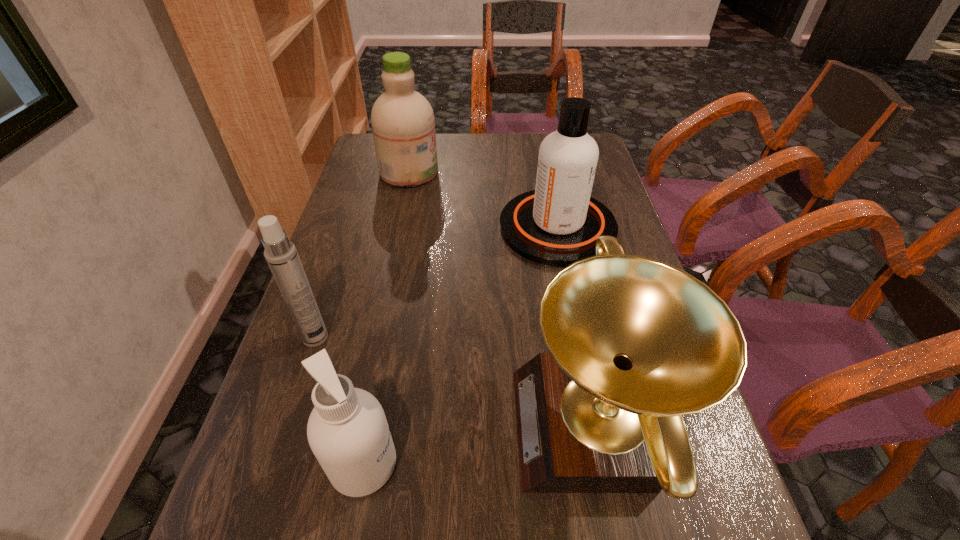
Select which cleansing agent is the closest to the award. Please provide its 2D coordinates. Your answer should be formatted as a tuple, i.e. [(x, y)], where the tuple contains the x and y coordinates of a point satisfying the conditions above.

[(347, 430)]

Where is `the closest cleansing agent relative to the second farthest object`? The image size is (960, 540). the closest cleansing agent relative to the second farthest object is located at coordinates (403, 125).

You are a GUI agent. You are given a task and a screenshot of the screen. Output one action in this format:
    pyautogui.click(x=<x>, y=<y>)
    Task: Click on the free space that satisfies the following two spatial constraints: 1. on the back side of the second nearest cleansing agent; 2. on the front label of the farthest object
    
    Given the screenshot: What is the action you would take?
    pyautogui.click(x=546, y=172)

The width and height of the screenshot is (960, 540). What are the coordinates of `vacant space that satisfies the following two spatial constraints: 1. on the front label of the farthest object; 2. on the left side of the second farthest cleansing agent` in the screenshot? It's located at (397, 227).

Locate an element on the screen. Image resolution: width=960 pixels, height=540 pixels. vacant position in the image that satisfies the following two spatial constraints: 1. on the back side of the aerosol can; 2. on the right side of the rightmost cleansing agent is located at coordinates (351, 227).

Identify the location of vacant space that satisfies the following two spatial constraints: 1. on the front label of the second nearest cleansing agent; 2. on the left side of the farthest cleansing agent. (397, 227).